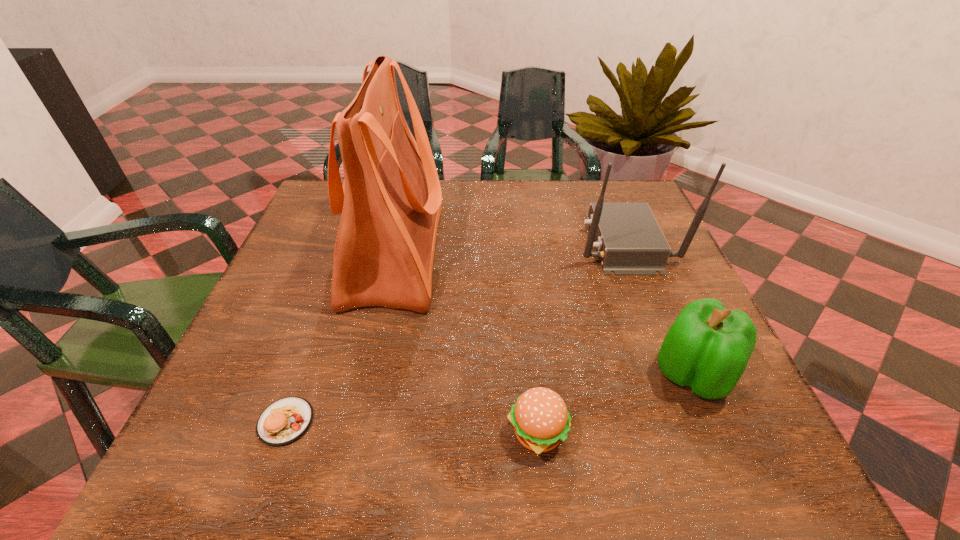
Identify the location of the tallest object. The image size is (960, 540). (390, 201).

Find the location of a particular element. the fourth shortest object is located at coordinates (629, 241).

Find the location of `bell pepper`. bell pepper is located at coordinates 707,348.

This screenshot has height=540, width=960. I want to click on hamburger, so click(x=541, y=420).

Find the location of a particular element. Image resolution: width=960 pixels, height=540 pixels. the fourth tallest object is located at coordinates (541, 420).

Find the location of a particular element. This screenshot has height=540, width=960. the shortest object is located at coordinates (286, 420).

Find the location of a particular element. Image resolution: width=960 pixels, height=540 pixels. free point located 0.230m on the front pocket of the tallest object is located at coordinates (540, 253).

You are a GUI agent. You are given a task and a screenshot of the screen. Output one action in this format:
    pyautogui.click(x=<x>, y=<y>)
    Task: Click on the blank area located 0.140m on the back of the router to connect cables
    This screenshot has height=540, width=960.
    Given the screenshot: What is the action you would take?
    pyautogui.click(x=519, y=243)

The image size is (960, 540). In order to click on free location located 0.340m on the back of the router to connect cables in this screenshot , I will do [439, 243].

This screenshot has width=960, height=540. Find the location of `vacant area situated on the back of the router to connect cables`. vacant area situated on the back of the router to connect cables is located at coordinates tap(543, 243).